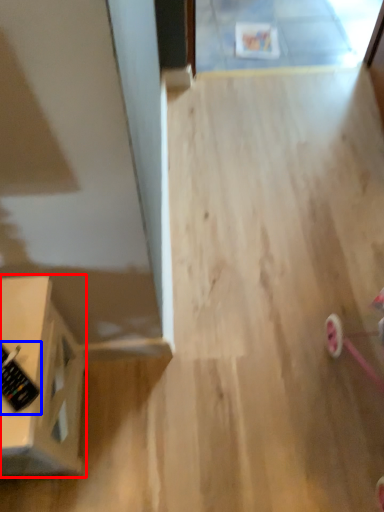
Question: Which of the following is the closest to the observer, furniture (highlighted by a red box) or control (highlighted by a blue box)?

Choices:
 (A) furniture
 (B) control

Answer: (A)